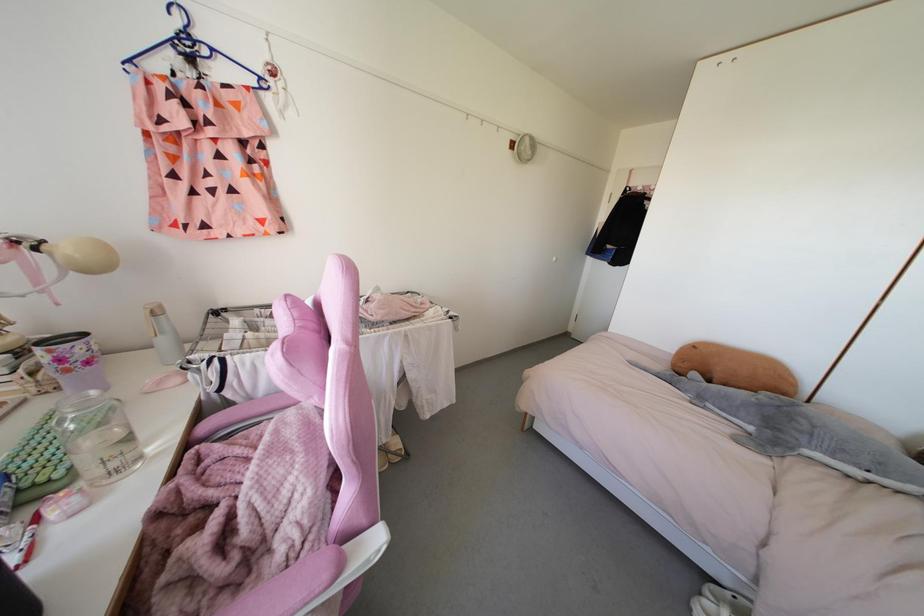
Where would you pull the white door handle? Please return your answer as a coordinate pair (x, y).

(545, 265)